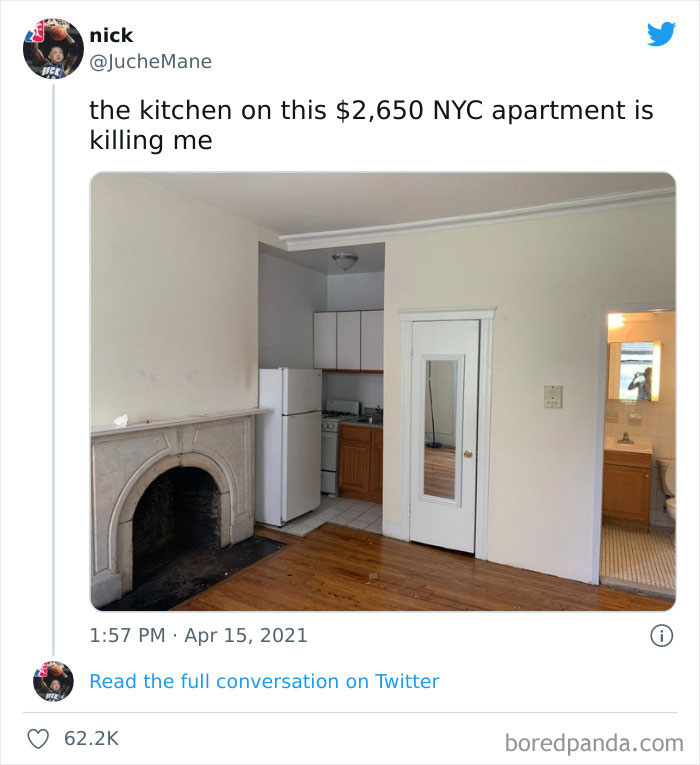
Identify the location of cabinet. The image size is (700, 765). (637, 495).